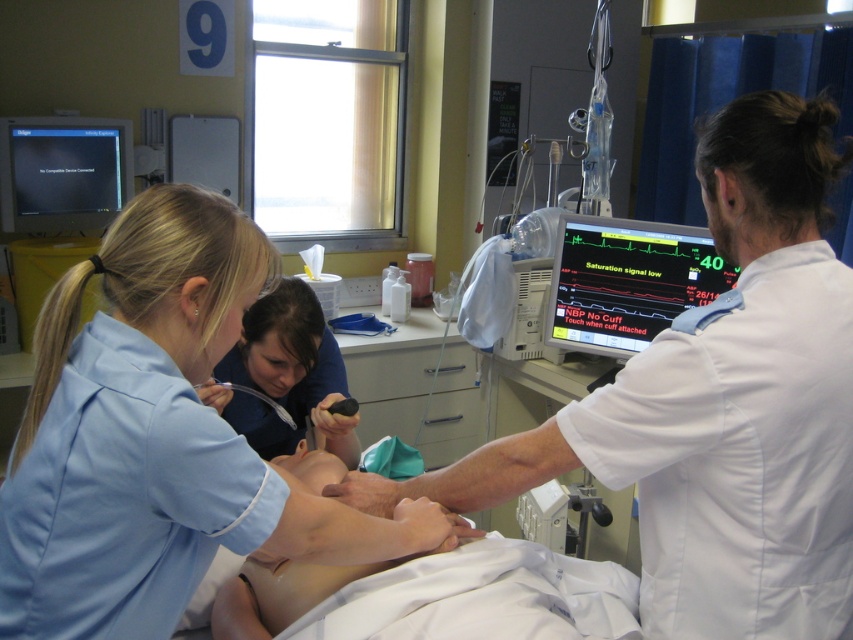
Looking at this image, you are a medical student observing a procedure in the hospital room. You notice two points marked on the patient. The first point is at coordinates point (x=560, y=305), and the second point is at point (x=22, y=211). Which point is closer to you as you stand at the foot of the bed?

Point (x=560, y=305) is closer to the viewer than point (x=22, y=211).

You are a nurse in the hospital room and need to check the patient vitals. Which monitor, the matte black monitor at center right or the matte black monitor at upper left, should you look at to ensure you can clearly see the vital signs displayed?

The matte black monitor at center right is larger in size than the matte black monitor at upper left, so you should look at the matte black monitor at center right to clearly see the vital signs displayed.